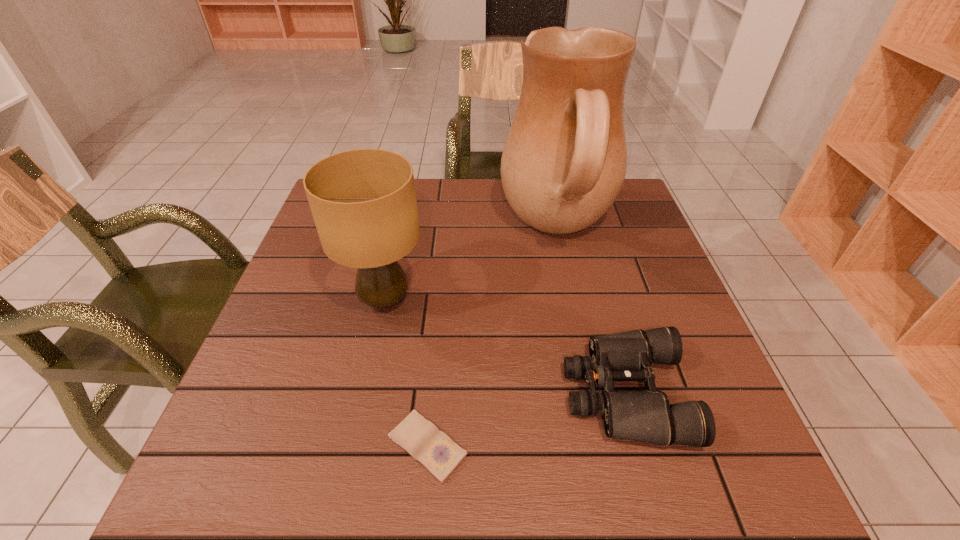
What are the coordinates of `the tallest object` in the screenshot? It's located at (564, 162).

The height and width of the screenshot is (540, 960). Identify the location of lampshade. (363, 201).

Locate an element on the screen. Image resolution: width=960 pixels, height=540 pixels. the third tallest object is located at coordinates (646, 415).

This screenshot has width=960, height=540. I want to click on diary, so click(433, 449).

This screenshot has width=960, height=540. Find the location of `free space located at the spout of the cream pitcher`. free space located at the spout of the cream pitcher is located at coordinates (429, 230).

I want to click on vacant space located at the spout of the cream pitcher, so click(393, 230).

The image size is (960, 540). I want to click on vacant space located 0.220m at the spout of the cream pitcher, so click(x=419, y=230).

You are a GUI agent. You are given a task and a screenshot of the screen. Output one action in this format:
    pyautogui.click(x=<x>, y=<y>)
    Task: Click on the free space located 0.050m on the front of the third shortest object
    The width and height of the screenshot is (960, 540).
    Given the screenshot: What is the action you would take?
    pyautogui.click(x=373, y=352)

Where is `free space located through the eyepieces of the second shortest object`? free space located through the eyepieces of the second shortest object is located at coordinates (485, 394).

Where is `free spot located through the eyepieces of the second shortest object`? This screenshot has width=960, height=540. free spot located through the eyepieces of the second shortest object is located at coordinates (351, 394).